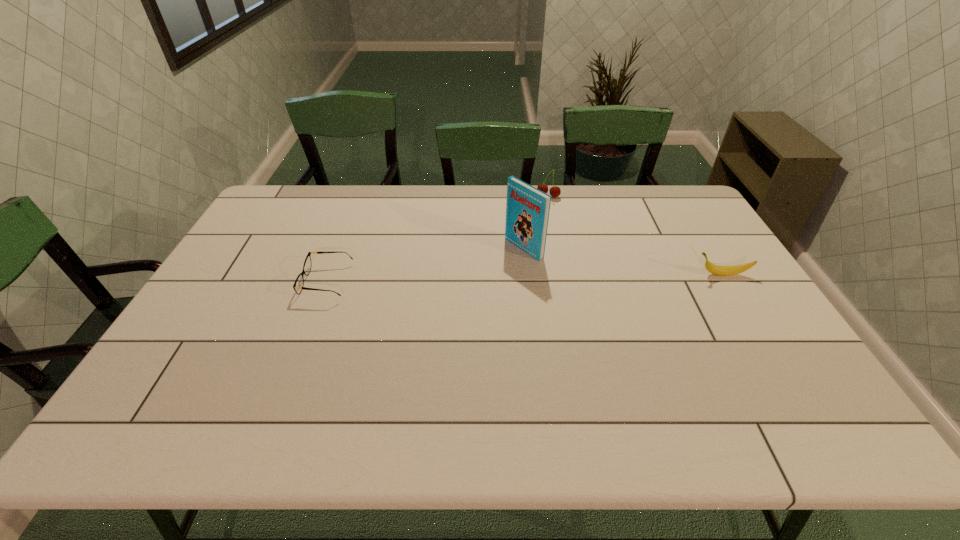
Locate an element on the screen. Image resolution: width=960 pixels, height=540 pixels. spectacles is located at coordinates click(299, 282).

Where is `the shortest object`? the shortest object is located at coordinates (299, 282).

Where is `banana`? The height and width of the screenshot is (540, 960). banana is located at coordinates (712, 268).

At what (x,y) coordinates should I click in order to perform the action: click on the second shortest object. Please return your answer as a coordinate pair (x, y). This screenshot has width=960, height=540. Looking at the image, I should click on (712, 268).

The image size is (960, 540). I want to click on the tallest object, so click(x=527, y=209).

At what (x,y) coordinates should I click in order to perform the action: click on the second farthest object. Please return your answer as a coordinate pair (x, y). This screenshot has width=960, height=540. Looking at the image, I should click on (527, 209).

In order to click on the farthest object in this screenshot , I will do `click(555, 191)`.

Locate an element on the screen. the second tallest object is located at coordinates (555, 191).

Where is `vacant area located 0.090m on the front-facing side of the leftmost object`? The image size is (960, 540). vacant area located 0.090m on the front-facing side of the leftmost object is located at coordinates (275, 281).

I want to click on free point located 0.210m on the front-facing side of the leftmost object, so click(x=233, y=281).